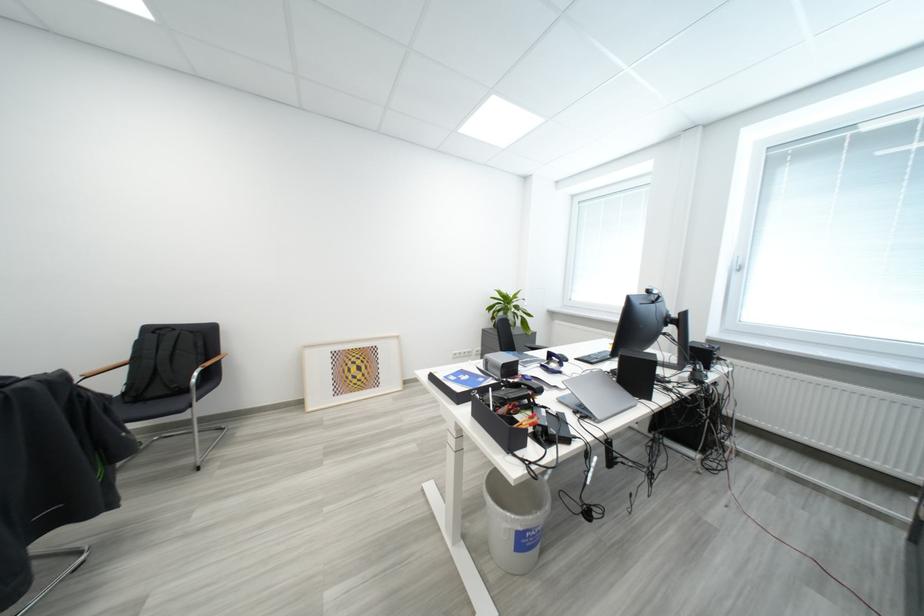
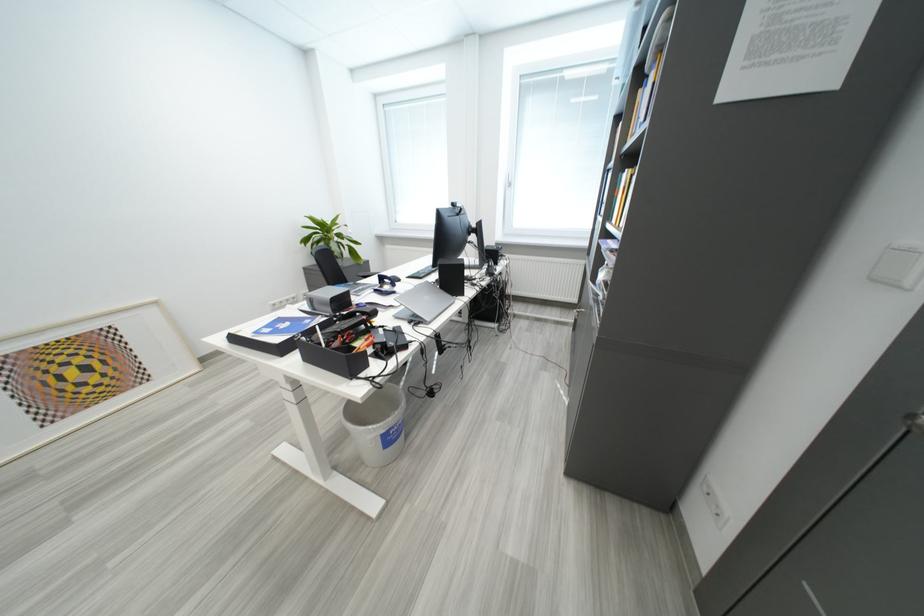
Find the pixel in the second image that matches point (569, 375) in the first image.

(403, 294)